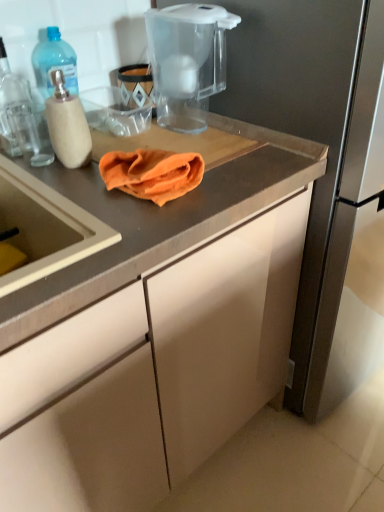
Question: Looking at their shapes, would you say orange cloth at center is wider or thinner than matte gray cabinet at center?

Choices:
 (A) thin
 (B) wide

Answer: (A)

Question: In terms of size, does orange cloth at center appear bigger or smaller than matte gray cabinet at center?

Choices:
 (A) small
 (B) big

Answer: (A)

Question: Estimate the real-world distances between objects in this image. Which object is farther from the translucent plastic bottle at left?

Choices:
 (A) orange cloth at center
 (B) transparent plastic water filter pitcher at upper center
 (C) matte gray cabinet at center

Answer: (C)

Question: Estimate the real-world distances between objects in this image. Which object is closer to the transparent plastic water filter pitcher at upper center?

Choices:
 (A) translucent plastic bottle at left
 (B) matte gray cabinet at center
 (C) orange cloth at center

Answer: (C)